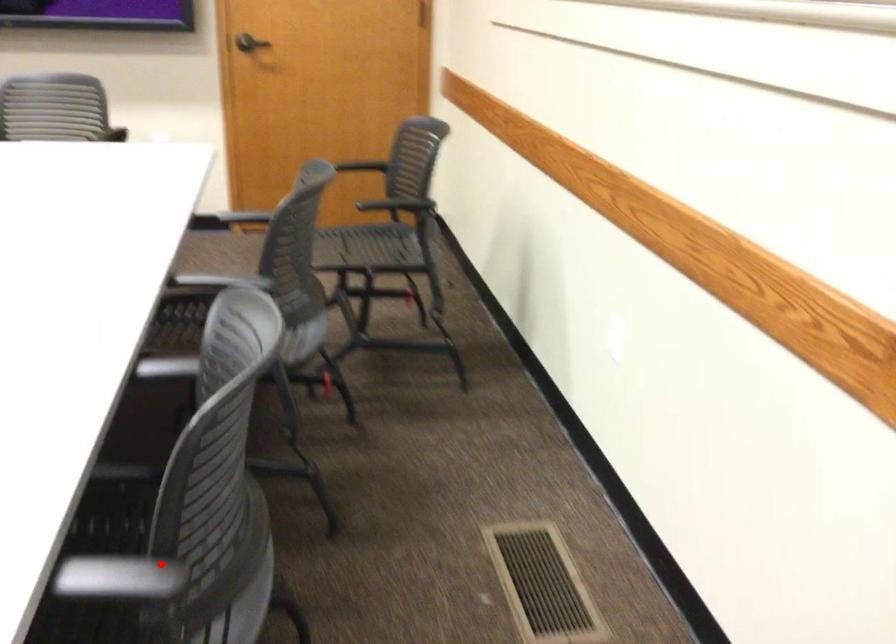
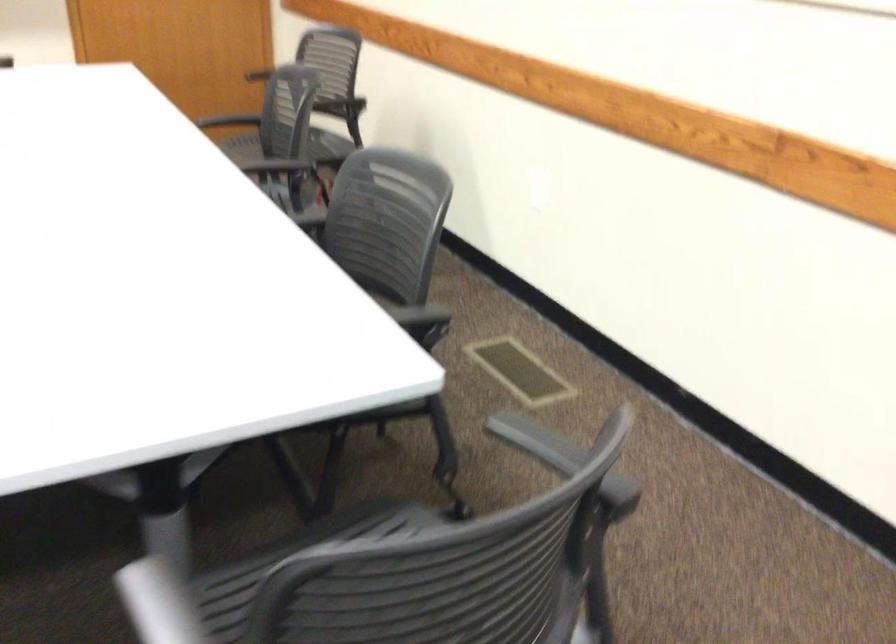
In the second image, find the point that corresponds to the highlighted location in the first image.

(419, 315)